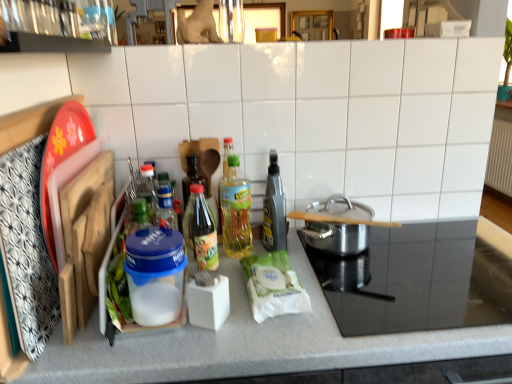
Question: Could you tell me if white matte countertop at center is turned towards polished stainless steel pot at center right?

Choices:
 (A) no
 (B) yes

Answer: (A)

Question: From a real-world perspective, is white matte countertop at center below polished stainless steel pot at center right?

Choices:
 (A) no
 (B) yes

Answer: (B)

Question: Is white matte countertop at center outside of polished stainless steel pot at center right?

Choices:
 (A) no
 (B) yes

Answer: (B)

Question: Considering the relative sizes of white matte countertop at center and polished stainless steel pot at center right in the image provided, is white matte countertop at center shorter than polished stainless steel pot at center right?

Choices:
 (A) no
 (B) yes

Answer: (A)

Question: Is white matte countertop at center positioned far away from polished stainless steel pot at center right?

Choices:
 (A) yes
 (B) no

Answer: (B)

Question: In terms of width, does white matte countertop at center look wider or thinner when compared to green glass bottle at center, which is counted as the first bottle, starting from the left?

Choices:
 (A) thin
 (B) wide

Answer: (B)

Question: Is white matte countertop at center in front of or behind green glass bottle at center, which is counted as the first bottle, starting from the left, in the image?

Choices:
 (A) behind
 (B) front

Answer: (B)

Question: Does point (285, 370) appear closer or farther from the camera than point (185, 208)?

Choices:
 (A) closer
 (B) farther

Answer: (A)

Question: Is white matte countertop at center taller or shorter than green glass bottle at center, the 3th bottle viewed from the right?

Choices:
 (A) tall
 (B) short

Answer: (A)

Question: Is point (271, 210) positioned closer to the camera than point (230, 172)?

Choices:
 (A) farther
 (B) closer

Answer: (A)

Question: From the image's perspective, is metallic gray spray bottle at center, which is the 3th bottle in left-to-right order, positioned above or below translucent plastic bottle at center, the 2th bottle from the left?

Choices:
 (A) above
 (B) below

Answer: (A)

Question: From their relative heights in the image, would you say metallic gray spray bottle at center, positioned as the 1th bottle in right-to-left order, is taller or shorter than translucent plastic bottle at center, acting as the second bottle starting from the right?

Choices:
 (A) short
 (B) tall

Answer: (A)

Question: Based on their sizes in the image, would you say metallic gray spray bottle at center, positioned as the 1th bottle in right-to-left order, is bigger or smaller than translucent plastic bottle at center, the 2th bottle from the left?

Choices:
 (A) small
 (B) big

Answer: (B)

Question: Considering the positions of point (449, 309) and point (245, 228), is point (449, 309) closer or farther from the camera than point (245, 228)?

Choices:
 (A) farther
 (B) closer

Answer: (B)

Question: From the image's perspective, is stainless steel pot at right, the second appliance in the left-to-right sequence, above or below translucent plastic bottle at center, the 2th bottle from the left?

Choices:
 (A) above
 (B) below

Answer: (B)